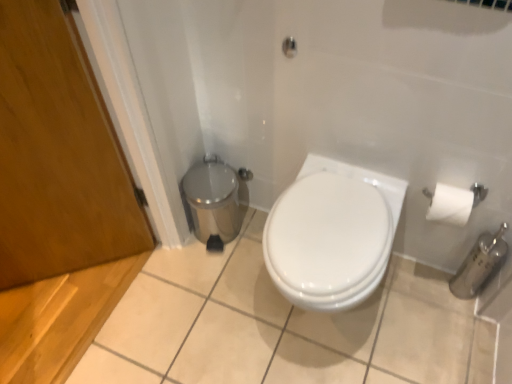
The height and width of the screenshot is (384, 512). Describe the element at coordinates (58, 154) in the screenshot. I see `wooden door at left` at that location.

Locate an element on the screen. Image resolution: width=512 pixels, height=384 pixels. wooden door at left is located at coordinates (58, 154).

Image resolution: width=512 pixels, height=384 pixels. In order to click on polished stainless steel trash can at lower left in this screenshot , I will do `click(214, 201)`.

How different are the orientations of wooden door at left and polished stainless steel trash can at lower left in degrees?

They differ by 15 degrees in their facing directions.

The width and height of the screenshot is (512, 384). What are the coordinates of `porcelain below the wooden door at left (from a real-world perspective)` in the screenshot? It's located at (214, 201).

Who is bigger, wooden door at left or polished stainless steel trash can at lower left?

Bigger between the two is wooden door at left.

Which of these two, white glossy toilet at center or wooden door at left, stands shorter?

With less height is white glossy toilet at center.

Is point (339, 301) less distant than point (90, 216)?

Yes, it is.

Is wooden door at left at the back of white glossy toilet at center?

white glossy toilet at center does not have its back to wooden door at left.

Based on the photo, from the image's perspective, which object appears higher, matte silver shower at upper center or wooden door at left?

matte silver shower at upper center.

Which point is more forward, (290, 50) or (121, 174)?

Positioned in front is point (290, 50).

Does matte silver shower at upper center come in front of wooden door at left?

No, matte silver shower at upper center is further to the viewer.

Considering the relative sizes of polished stainless steel trash can at lower left and matte silver shower at upper center in the image provided, is polished stainless steel trash can at lower left bigger than matte silver shower at upper center?

Yes.

Is polished stainless steel trash can at lower left facing towards matte silver shower at upper center?

No, polished stainless steel trash can at lower left is not turned towards matte silver shower at upper center.

Would you say polished stainless steel trash can at lower left is a long distance from matte silver shower at upper center?

No.

Where is `porcelain behind the white glossy toilet at center`? Image resolution: width=512 pixels, height=384 pixels. porcelain behind the white glossy toilet at center is located at coordinates click(214, 201).

Would you say polished stainless steel trash can at lower left is inside or outside white glossy toilet at center?

polished stainless steel trash can at lower left is spatially situated outside white glossy toilet at center.

Which of these two, polished stainless steel trash can at lower left or white glossy toilet at center, is thinner?

Thinner between the two is polished stainless steel trash can at lower left.

Is white glossy toilet at center not close to polished stainless steel trash can at lower left?

They are positioned close to each other.

Considering the relative sizes of white glossy toilet at center and polished stainless steel trash can at lower left in the image provided, is white glossy toilet at center taller than polished stainless steel trash can at lower left?

Yes.

Does white glossy toilet at center have a lesser width compared to polished stainless steel trash can at lower left?

No, white glossy toilet at center is not thinner than polished stainless steel trash can at lower left.

The height and width of the screenshot is (384, 512). I want to click on toilet in front of the polished stainless steel trash can at lower left, so click(x=329, y=240).

Is wooden door at left at the right side of matte silver shower at upper center?

No.

Is wooden door at left spatially inside matte silver shower at upper center, or outside of it?

The correct answer is: outside.

Is wooden door at left far from matte silver shower at upper center?

They are positioned close to each other.

Can you confirm if wooden door at left is smaller than matte silver shower at upper center?

Incorrect, wooden door at left is not smaller in size than matte silver shower at upper center.

You are a GUI agent. You are given a task and a screenshot of the screen. Output one action in this format:
    pyautogui.click(x=<x>, y=<y>)
    Task: Click on the screen door that is on the left side of polished stainless steel trash can at lower left
    Image resolution: width=512 pixels, height=384 pixels.
    Given the screenshot: What is the action you would take?
    pyautogui.click(x=58, y=154)

This screenshot has width=512, height=384. I want to click on screen door that is in front of the white glossy toilet at center, so click(58, 154).

Estimate the real-world distances between objects in this image. Which object is closer to wooden door at left, white glossy toilet at center or matte silver shower at upper center?

white glossy toilet at center is closer to wooden door at left.

Based on their spatial positions, is wooden door at left or polished stainless steel trash can at lower left further from matte silver shower at upper center?

wooden door at left.

Considering their positions, is white glossy toilet at center positioned closer to polished stainless steel trash can at lower left than wooden door at left?

wooden door at left lies closer to polished stainless steel trash can at lower left than the other object.

Based on their spatial positions, is polished stainless steel trash can at lower left or white glossy toilet at center further from matte silver shower at upper center?

polished stainless steel trash can at lower left.

When comparing their distances from wooden door at left, does matte silver shower at upper center or polished stainless steel trash can at lower left seem further?

matte silver shower at upper center is further to wooden door at left.

Estimate the real-world distances between objects in this image. Which object is closer to white glossy toilet at center, matte silver shower at upper center or wooden door at left?

matte silver shower at upper center lies closer to white glossy toilet at center than the other object.

From the picture: Based on their spatial positions, is white glossy toilet at center or matte silver shower at upper center closer to polished stainless steel trash can at lower left?

white glossy toilet at center is closer to polished stainless steel trash can at lower left.

Looking at the image, which one is located further to polished stainless steel trash can at lower left, wooden door at left or white glossy toilet at center?

white glossy toilet at center is positioned further to the anchor polished stainless steel trash can at lower left.

Locate an element on the screen. The image size is (512, 384). shower between wooden door at left and white glossy toilet at center in the horizontal direction is located at coordinates (289, 47).

Identify the location of porcelain between matte silver shower at upper center and white glossy toilet at center vertically. Image resolution: width=512 pixels, height=384 pixels. (214, 201).

This screenshot has height=384, width=512. Identify the location of porcelain situated between wooden door at left and matte silver shower at upper center from left to right. (214, 201).

Find the location of `porcelain between wooden door at left and white glossy toilet at center in the horizontal direction`. porcelain between wooden door at left and white glossy toilet at center in the horizontal direction is located at coordinates (214, 201).